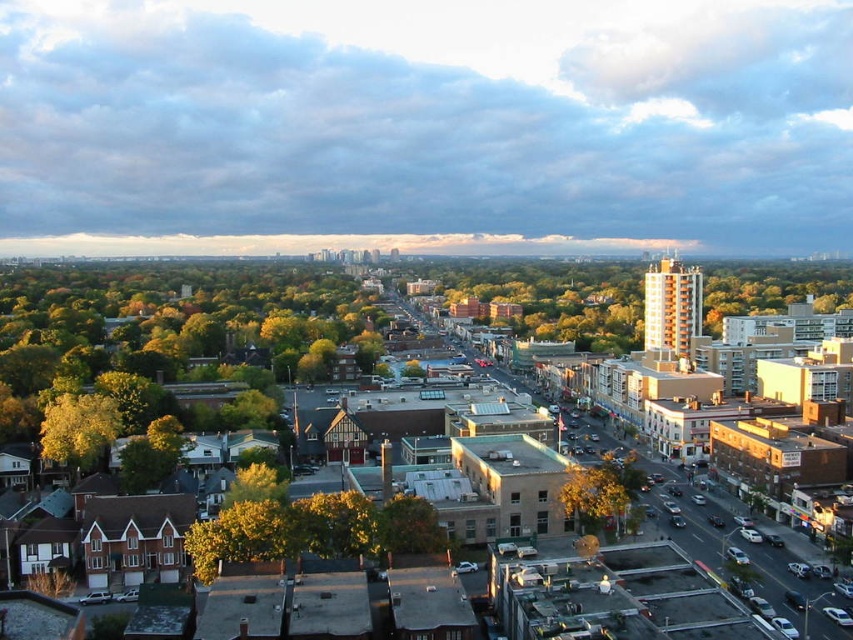
You are a city planner analyzing the urban layout. You observe the green leafy tree at lower left and the green matte tree at center. Which tree is closer to the viewer?

The green leafy tree at lower left is closer to the viewer because it is positioned over the green matte tree at center, indicating it is in front.